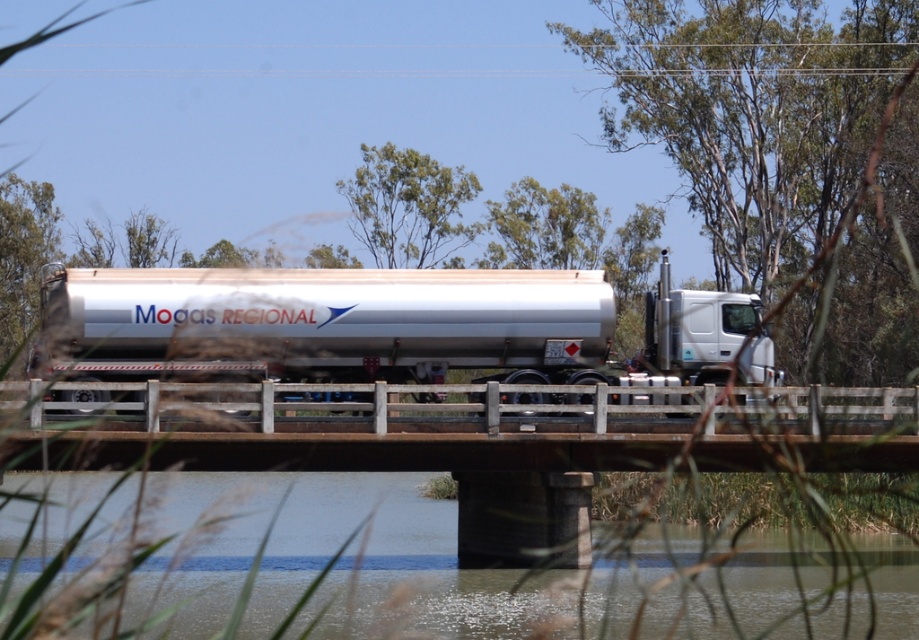
You are a driver in the brushed metal trailer truck at center. You need to cross the concrete bridge at center. Based on the scene, can you safely pass under the bridge without hitting the truck?

The concrete bridge at center is located below the brushed metal trailer truck at center, which means the truck is already on the bridge. Therefore, the truck has successfully passed under any potential low clearance without issues.

You are a photographer standing at the edge of the bridge, and you want to capture a clear photo of the brushed metal trailer truck at center. The camera you are using has a maximum focus range of 90 feet. Will the truck be in focus?

The brushed metal trailer truck at center is 89.40 feet from the camera, which is within the maximum focus range of 90 feet. Therefore, the truck will be in focus.